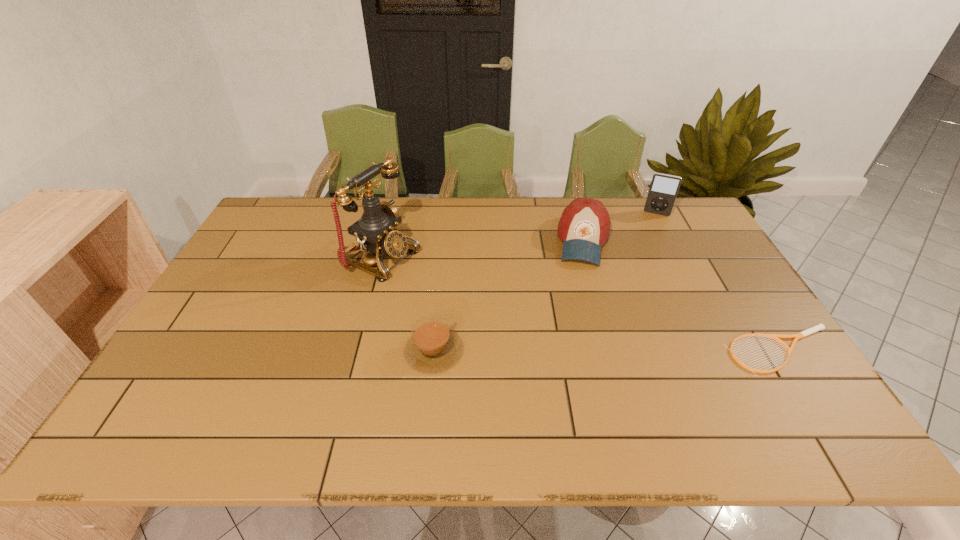
Find the location of a particular element. The width and height of the screenshot is (960, 540). vacant space located on the front-facing side of the third object from left to right is located at coordinates (580, 328).

Find the location of `free space located on the front-facing side of the iPod`. free space located on the front-facing side of the iPod is located at coordinates (645, 256).

This screenshot has height=540, width=960. I want to click on vacant space located on the front-facing side of the iPod, so click(651, 229).

Locate an element on the screen. free space located on the front-facing side of the iPod is located at coordinates (650, 234).

Identify the location of free space located 0.190m on the front of the telephone, featuring the rotary dial. (466, 293).

I want to click on vacant region located on the front of the telephone, featuring the rotary dial, so click(524, 318).

This screenshot has height=540, width=960. In order to click on vacant space situated 0.290m on the front of the telephone, featuring the rotary dial in this screenshot , I will do tap(495, 306).

Where is `baseball cap at the far edge`? Image resolution: width=960 pixels, height=540 pixels. baseball cap at the far edge is located at coordinates (584, 226).

Locate an element on the screen. The image size is (960, 540). iPod at the far edge is located at coordinates [664, 188].

This screenshot has height=540, width=960. Identify the location of telephone that is positioned at the far edge. (376, 231).